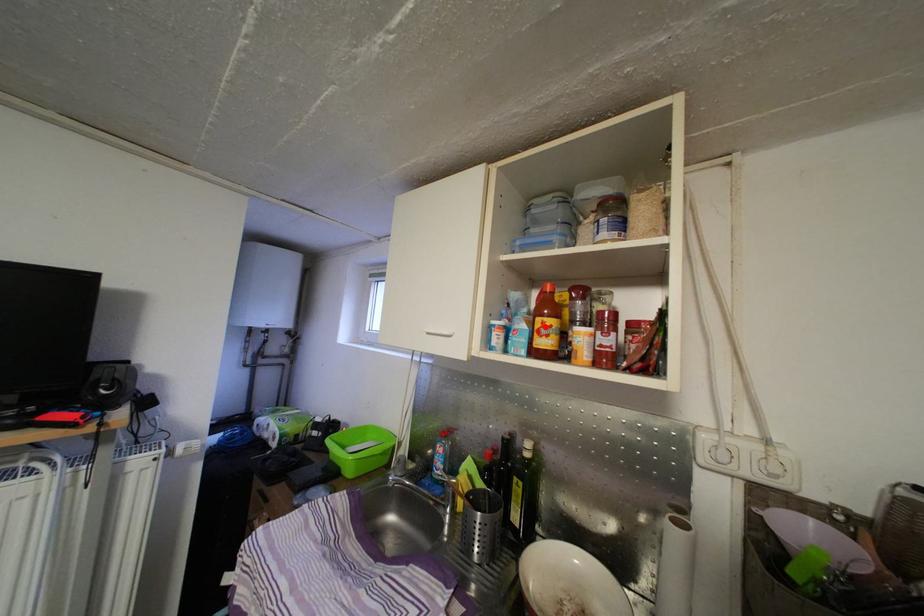
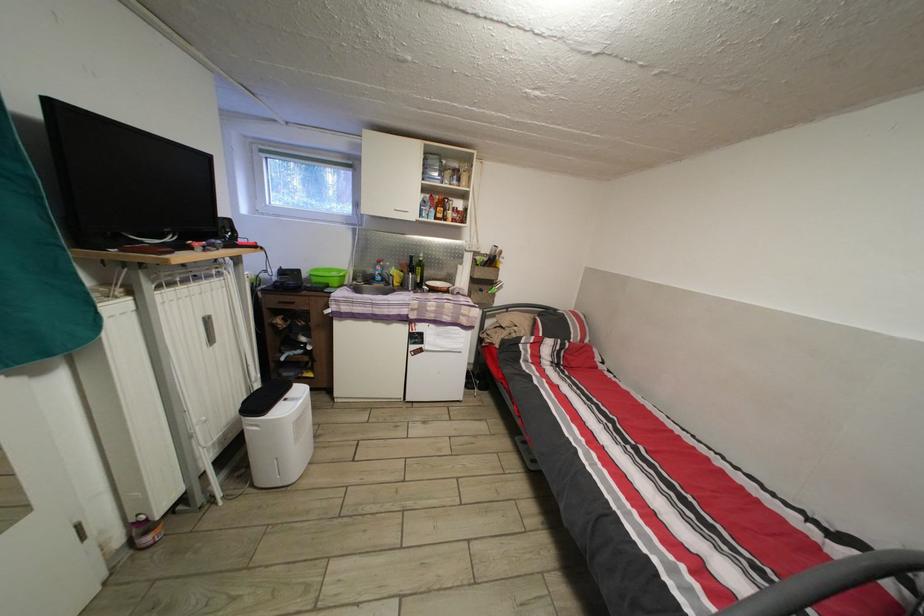
Question: I am providing you with two images of the same scene from different viewpoints. A red point is marked on the first image. Can you still see the location of the red point in image 2?

Choices:
 (A) Yes
 (B) No

Answer: (A)